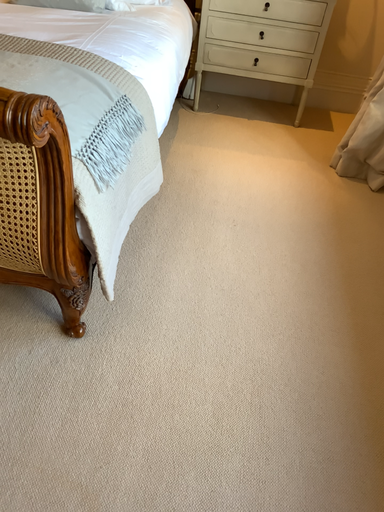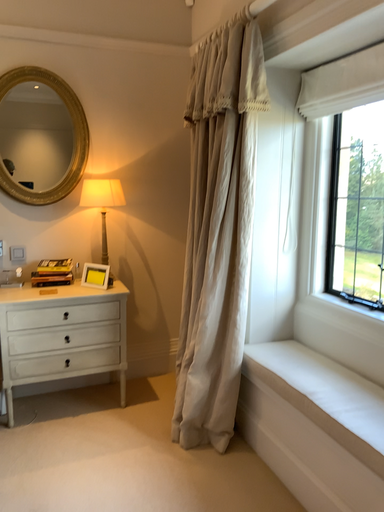
Question: Which way did the camera rotate in the video?

Choices:
 (A) rotated upward
 (B) rotated downward

Answer: (A)